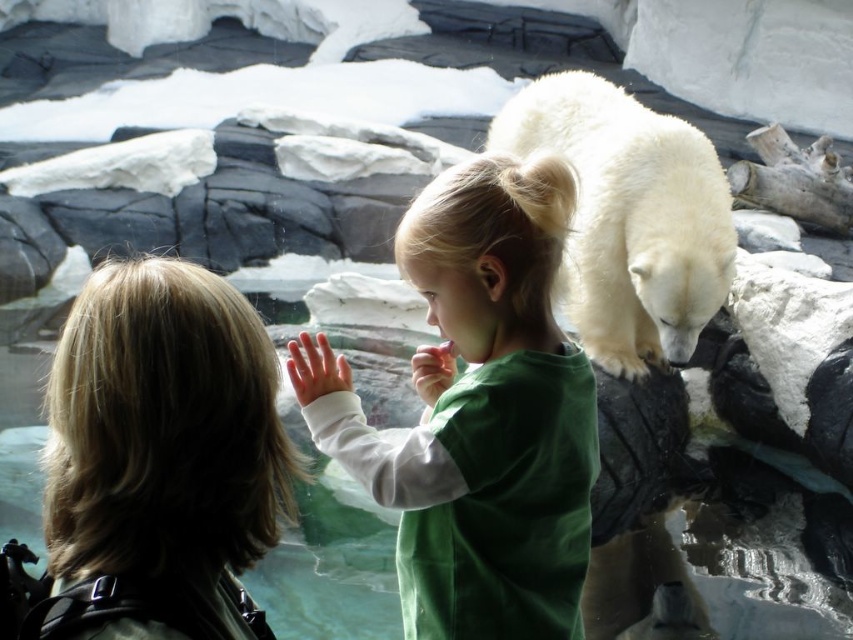
This screenshot has width=853, height=640. What do you see at coordinates (479, 412) in the screenshot?
I see `green cotton shirt at center` at bounding box center [479, 412].

Based on the photo, is green cotton shirt at center below white fluffy polar bear at upper right?

Yes.

What do you see at coordinates (479, 412) in the screenshot? Image resolution: width=853 pixels, height=640 pixels. I see `green cotton shirt at center` at bounding box center [479, 412].

At what (x,y) coordinates should I click in order to perform the action: click on green cotton shirt at center. Please return your answer as a coordinate pair (x, y). This screenshot has width=853, height=640. Looking at the image, I should click on (479, 412).